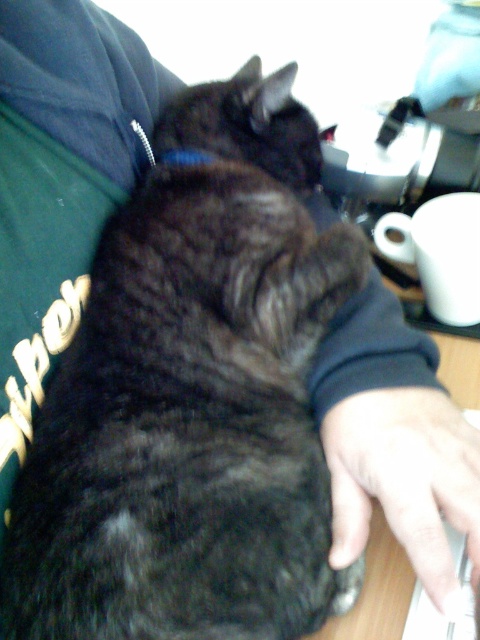
Is smooth skin hand at lower right in front of blue fabric neckband at upper center?

Yes, it is.

Which of these two, smooth skin hand at lower right or blue fabric neckband at upper center, stands taller?

Standing taller between the two is smooth skin hand at lower right.

Between point (335, 540) and point (164, 154), which one is positioned in front?

Point (335, 540) is in front.

The width and height of the screenshot is (480, 640). I want to click on smooth skin hand at lower right, so click(405, 480).

Who is lower down, fuzzy black cat at center or blue fabric neckband at upper center?

fuzzy black cat at center is lower down.

Who is positioned more to the right, fuzzy black cat at center or blue fabric neckband at upper center?

fuzzy black cat at center is more to the right.

Who is more distant from viewer, [92,273] or [189,148]?

Positioned behind is point [189,148].

You are a GUI agent. You are given a task and a screenshot of the screen. Output one action in this format:
    pyautogui.click(x=<x>, y=<y>)
    Task: Click on the fuzzy black cat at center
    The height and width of the screenshot is (640, 480).
    Given the screenshot: What is the action you would take?
    pyautogui.click(x=192, y=397)

How much distance is there between fuzzy black cat at center and smooth skin hand at lower right?

They are 5.89 inches apart.

Can you confirm if fuzzy black cat at center is thinner than smooth skin hand at lower right?

Incorrect, fuzzy black cat at center's width is not less than smooth skin hand at lower right's.

Which is behind, point (132, 582) or point (398, 403)?

The point (398, 403) is more distant.

The height and width of the screenshot is (640, 480). Find the location of `fuzzy black cat at center`. fuzzy black cat at center is located at coordinates (192, 397).